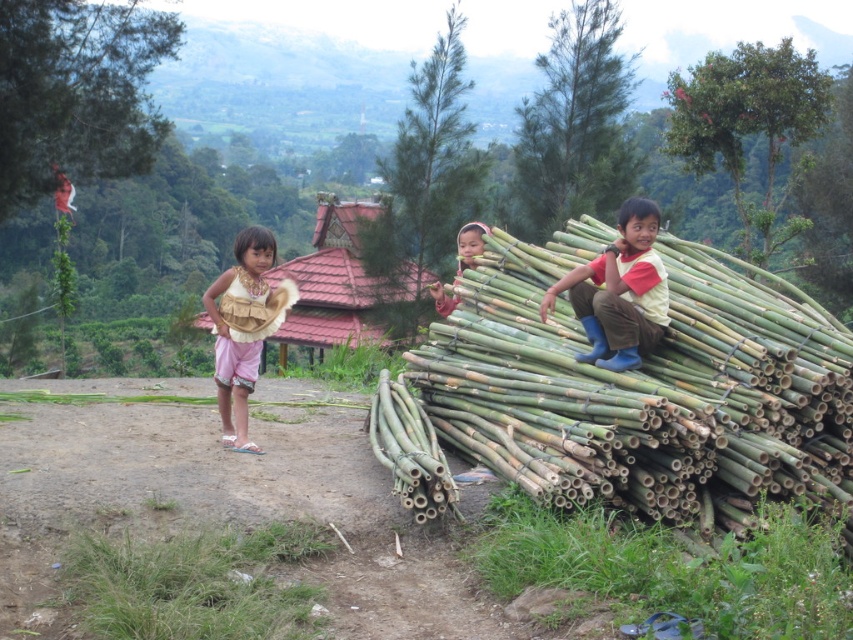
You are a delivery person carrying a package that is 1 meter wide. You need to walk through the dirt path in the foreground. There are green bamboo logs at right and a matte yellow shirt at right nearby. Which object is wider, and will your package fit through the space between them?

The green bamboo logs at right are wider than the matte yellow shirt at right. Since the package is 1 meter wide and the green bamboo logs at right are wider, the space between them may be narrower than 1 meter. Therefore, the package might not fit through the space between the green bamboo logs at right and the matte yellow shirt at right.